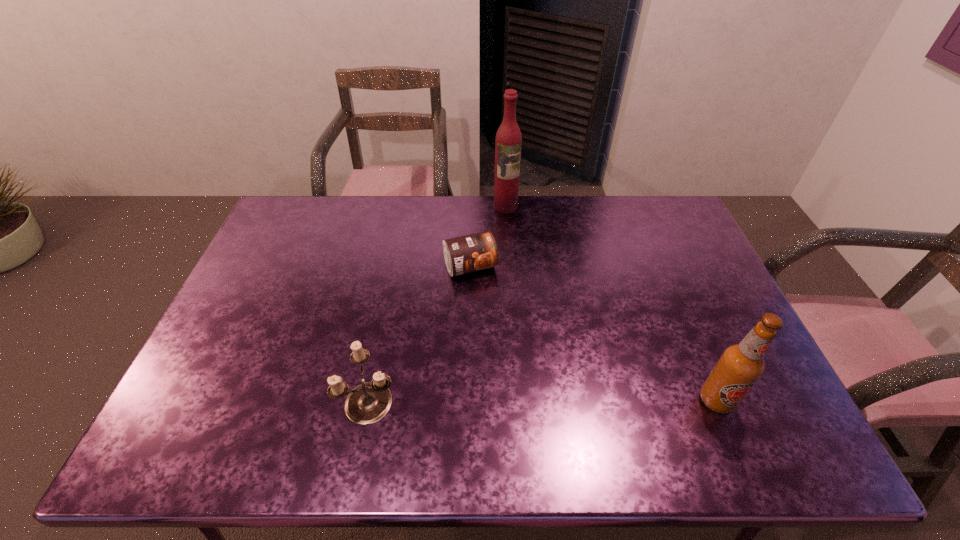
Identify the location of free space at the far edge. (516, 227).

Find the location of a particular element. The width and height of the screenshot is (960, 540). vacant area at the near edge of the desktop is located at coordinates (686, 414).

Where is `vacant space at the left edge`? The height and width of the screenshot is (540, 960). vacant space at the left edge is located at coordinates (288, 251).

What are the coordinates of `vacant space at the right edge of the desktop` in the screenshot? It's located at (716, 303).

The width and height of the screenshot is (960, 540). I want to click on blank area at the far left corner, so click(317, 221).

Image resolution: width=960 pixels, height=540 pixels. In the image, there is a desktop. In order to click on vacant space at the far right corner in this screenshot , I will do `click(639, 215)`.

This screenshot has height=540, width=960. What are the coordinates of `free space that is in between the liquor and the second shortest object` in the screenshot? It's located at (439, 303).

Where is `empty location between the second tallest object and the tallest object`? The width and height of the screenshot is (960, 540). empty location between the second tallest object and the tallest object is located at coordinates (611, 303).

Find the location of a particular element. Image resolution: width=960 pixels, height=540 pixels. free space between the beer bottle and the shortest object is located at coordinates (593, 333).

You are a GUI agent. You are given a task and a screenshot of the screen. Output one action in this format:
    pyautogui.click(x=<x>, y=<y>)
    Task: Click on the free space between the liquor and the second shortest object
    
    Given the screenshot: What is the action you would take?
    pyautogui.click(x=439, y=303)